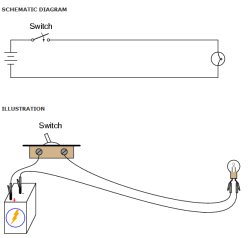
Locate an element on the screen. Image resolution: width=250 pixels, height=238 pixels. box is located at coordinates (81, 61), (169, 64), (197, 52), (23, 65).